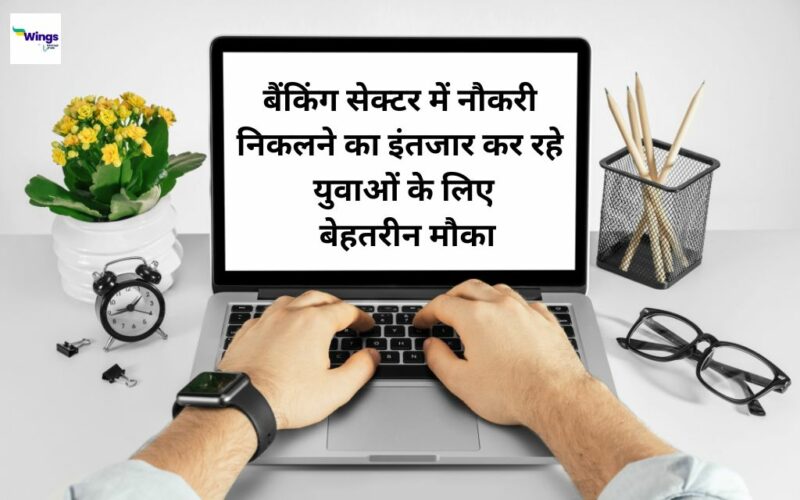
This screenshot has height=500, width=800. Identify the location of grey desk area. (74, 434), (766, 300).